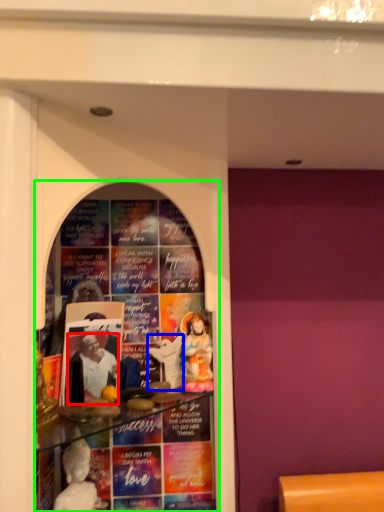
Question: Based on their relative distances, which object is nearer to person (highlighted by a red box)? Choose from toy (highlighted by a blue box) and shop window (highlighted by a green box).

Choices:
 (A) toy
 (B) shop window

Answer: (A)